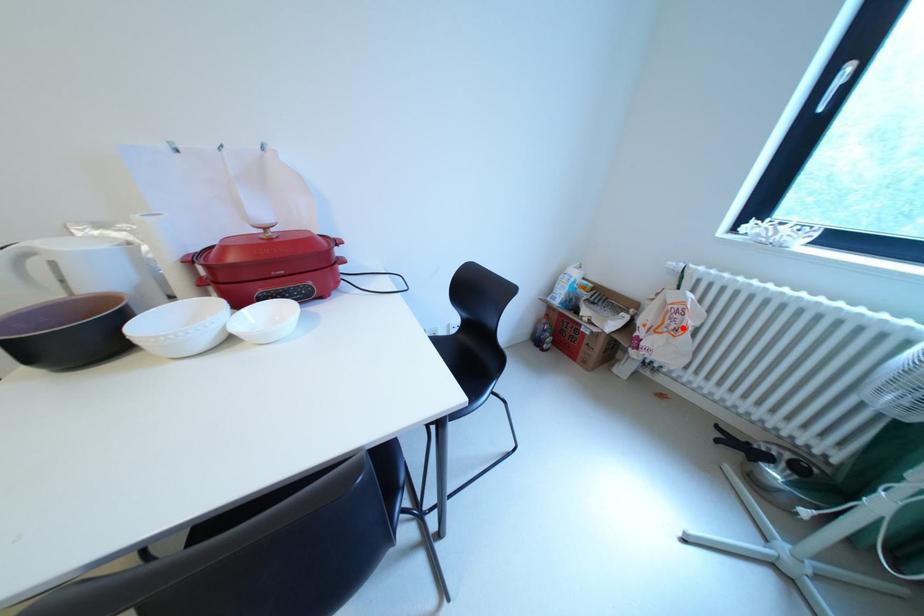
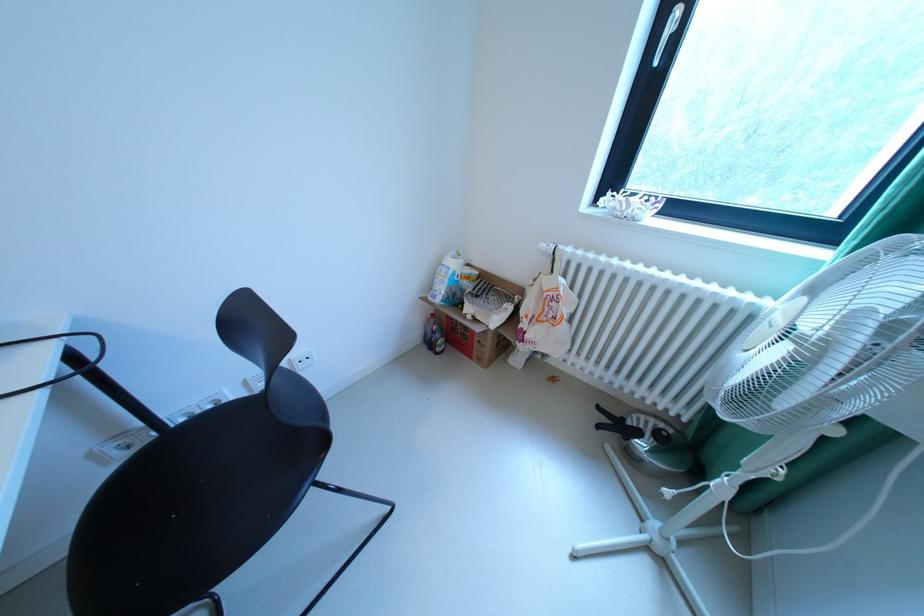
The point at the highlighted location is marked in the first image. Where is the corresponding point in the second image?

(561, 317)